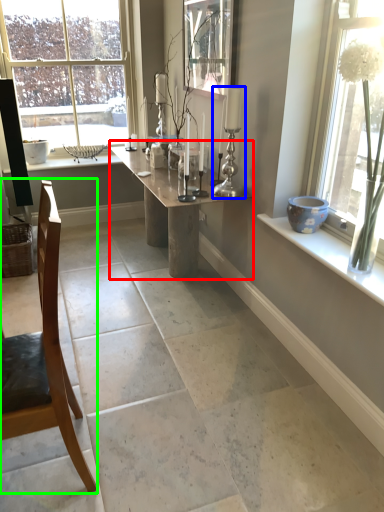
Question: Which object is the closest to the table (highlighted by a red box)? Choose among these: candle holder (highlighted by a blue box) or chair (highlighted by a green box).

Choices:
 (A) candle holder
 (B) chair

Answer: (A)